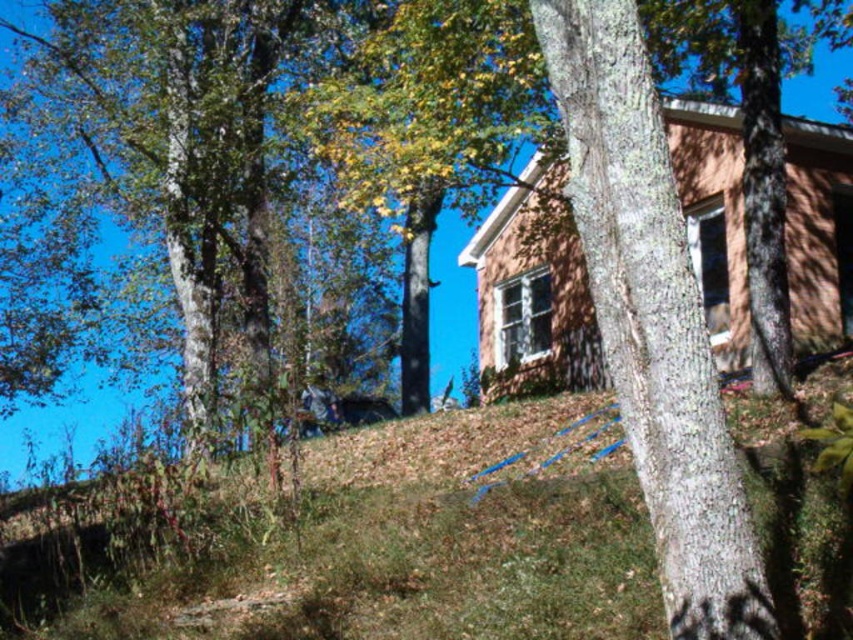
Describe the element at coordinates (653, 320) in the screenshot. This screenshot has width=853, height=640. I see `smooth bark tree at center` at that location.

Does smooth bark tree at center appear on the right side of rustic wooden cabin at center?

No, smooth bark tree at center is not to the right of rustic wooden cabin at center.

You are a GUI agent. You are given a task and a screenshot of the screen. Output one action in this format:
    pyautogui.click(x=<x>, y=<y>)
    Task: Click on the smooth bark tree at center
    The image size is (853, 640).
    Given the screenshot: What is the action you would take?
    pyautogui.click(x=653, y=320)

Find the location of `smooth bark tree at center`. smooth bark tree at center is located at coordinates (653, 320).